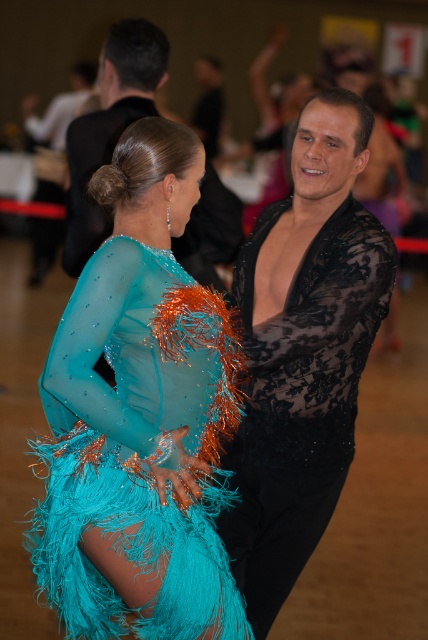
You are a photographer at the dance event. You need to capture a photo where both the black lace shirt at center and the black lace shirt at upper center are visible. Which shirt should you focus on to ensure the smaller one is in the frame?

You should focus on the black lace shirt at center because it is smaller than the black lace shirt at upper center, so ensuring the smaller one is in frame requires attention to its position.

What object is located at the coordinates point (139, 417) in the image?

The point (139, 417) marks the turquoise sheer dress at center.

You are a photographer at the dance event. You need to capture a photo where both the turquoise sheer dress at center and the black lace shirt at upper center are visible. Which object should you focus on to ensure both are in frame?

The turquoise sheer dress at center is wider than the black lace shirt at upper center, so focusing on the center where the turquoise sheer dress is located will ensure both objects are in frame.